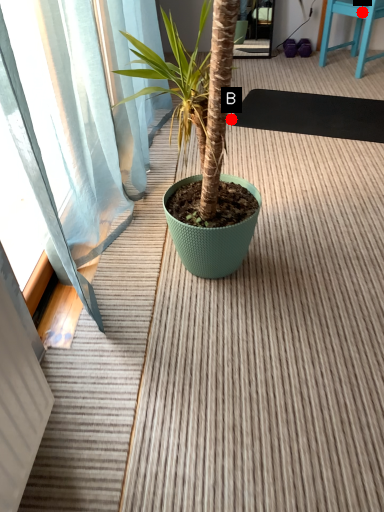
Question: Two points are circled on the image, labeled by A and B beside each circle. Which point is farther to the camera?

Choices:
 (A) A is further
 (B) B is further

Answer: (A)